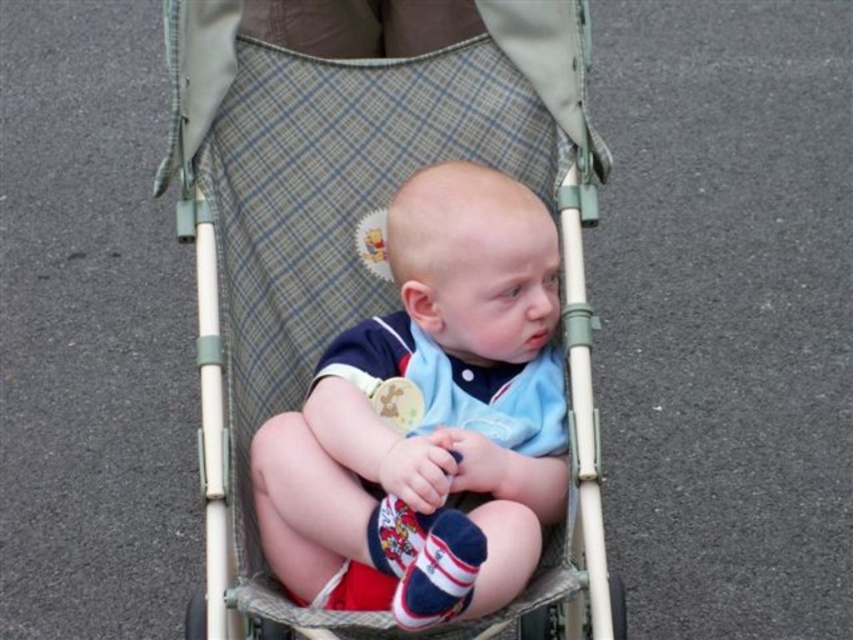
You are a photographer taking a picture of the baby in the stroller. You want to ensure the light blue cotton shirt at center is fully visible in the photo. Should you adjust the angle to move the plaid fabric baby carriage at center out of the way?

The light blue cotton shirt at center is behind the plaid fabric baby carriage at center, so adjusting the angle to move the plaid fabric baby carriage at center out of the way would make the light blue cotton shirt at center more visible.

You are taking a photo of the baby in the stroller and notice two points marked on the image. The first point is at coordinate point (202,419) and the second is at point (289,588). Which point is closer to the camera?

Point (202,419) is further to the camera than point (289,588), so the second point is closer to the camera.

You need to pack both the plaid fabric baby carriage at center and the light blue cotton shirt at center into a storage box. Which object should you place first into the box to ensure both fit properly?

The plaid fabric baby carriage at center is larger in size than the light blue cotton shirt at center, so you should place the plaid fabric baby carriage at center first to ensure there is enough space for the smaller item afterward.